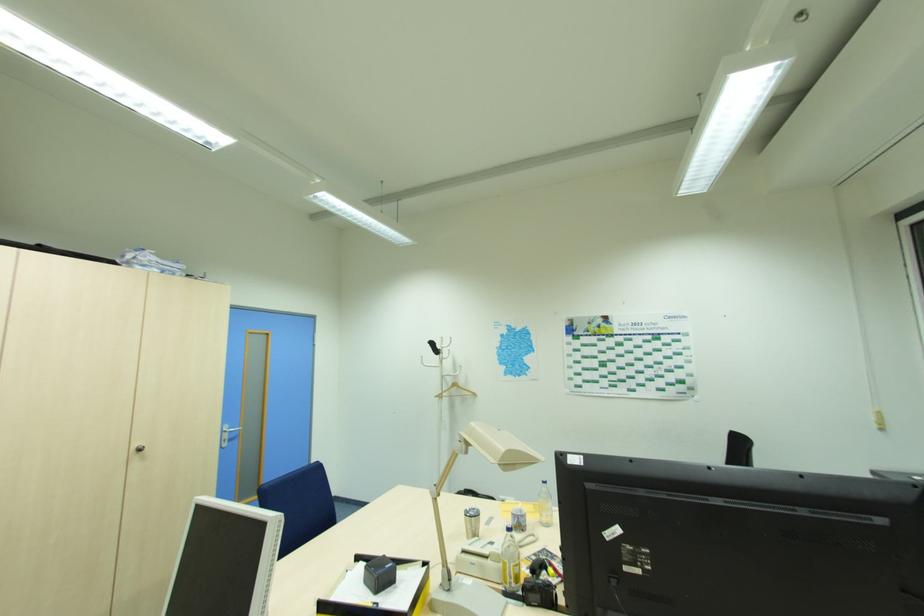
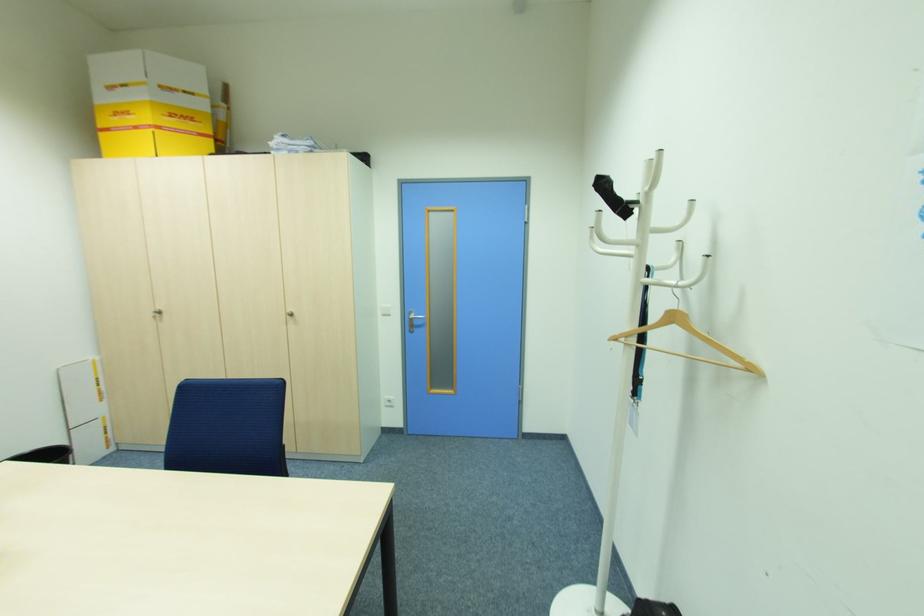
Locate, in the second image, the point that corresponds to point (477, 394) in the first image.

(756, 370)